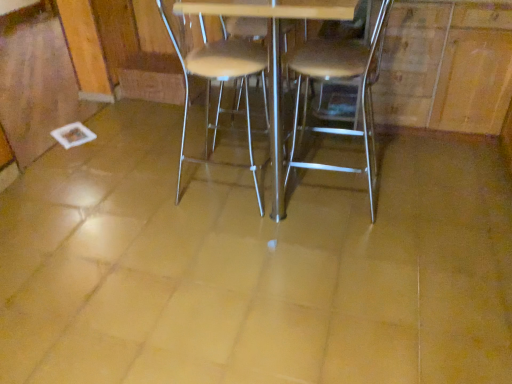
In order to click on vacant area that is situated to the right of metallic silver chair at center, the first chair positioned from the right in this screenshot , I will do `click(420, 190)`.